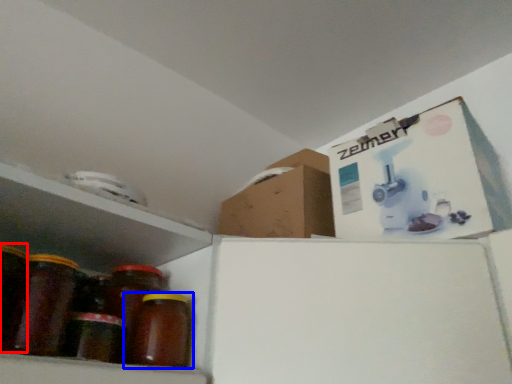
Question: Which point is closer to the camera, glass jar (highlighted by a red box) or bottle (highlighted by a blue box)?

Choices:
 (A) glass jar
 (B) bottle

Answer: (A)